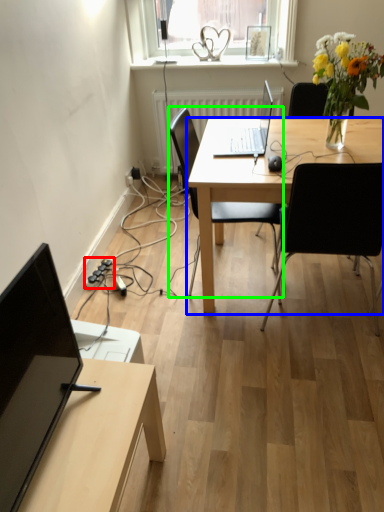
Question: Based on their relative distances, which object is nearer to extension cord (highlighted by a red box)? Choose from desk (highlighted by a blue box) and chair (highlighted by a green box).

Choices:
 (A) desk
 (B) chair

Answer: (B)